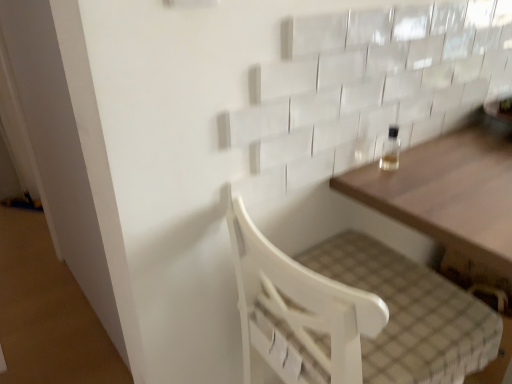
The image size is (512, 384). What are the coordinates of `vacant space to the right of clear glass bottle at upper right` in the screenshot? It's located at (438, 156).